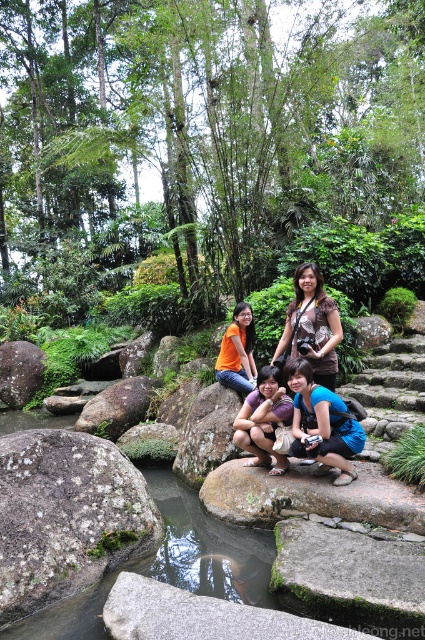
What is the object located at the coordinates point (201,616) in the image?

The point (201,616) indicates a gray rough stone at center.

You are taking a photo of the forest scene and want to focus on both the point at coordinates point (48, 550) and point (204, 442). Which point should you adjust your camera focus to first if you want to ensure the nearest object is in focus?

Point (48, 550) is closer to the camera than point (204, 442), so you should focus on point (48, 550) first to ensure the nearest object is in focus.